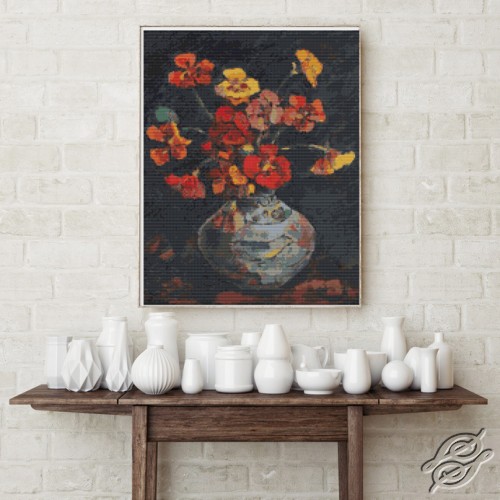
The image size is (500, 500). Identify the location of vase. (105, 334).